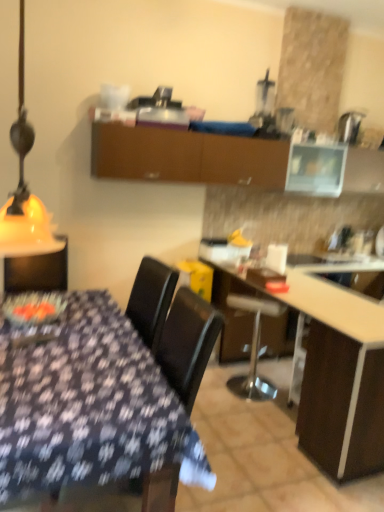
Where is `white glossy countertop at center`? This screenshot has width=384, height=512. white glossy countertop at center is located at coordinates (327, 298).

This screenshot has width=384, height=512. Find the location of `wooden table at center`. wooden table at center is located at coordinates (333, 370).

What are the coordinates of `brown matte cabinet at upper center` in the screenshot? It's located at (186, 156).

Describe the element at coordinates (254, 348) in the screenshot. I see `metallic silver bar stool at center` at that location.

Image resolution: width=384 pixels, height=512 pixels. What are the coordinates of `yellow matte lampshade at left` in the screenshot? It's located at (24, 189).

From the image's perspective, which is above, brown matte cabinet at upper center or metallic silver bar stool at center?

From the image's view, brown matte cabinet at upper center is above.

Which of these two, brown matte cabinet at upper center or metallic silver bar stool at center, is thinner?

metallic silver bar stool at center.

In order to click on cabinetry on the right side of metallic silver bar stool at center in this screenshot , I will do `click(186, 156)`.

In the image, is brown matte cabinet at upper center positioned in front of or behind metallic silver bar stool at center?

Visually, brown matte cabinet at upper center is located behind metallic silver bar stool at center.

From the image's perspective, which one is positioned lower, metallic silver bar stool at center or black matte chair at center?

black matte chair at center appears lower in the image.

Can you confirm if metallic silver bar stool at center is positioned to the left of black matte chair at center?

In fact, metallic silver bar stool at center is to the right of black matte chair at center.

Is black matte chair at center at the back of metallic silver bar stool at center?

Yes, metallic silver bar stool at center is facing away from black matte chair at center.

Between yellow matte lampshade at left and metallic silver bar stool at center, which one appears on the left side from the viewer's perspective?

From the viewer's perspective, yellow matte lampshade at left appears more on the left side.

Is yellow matte lampshade at left facing towards metallic silver bar stool at center?

No, yellow matte lampshade at left is not aimed at metallic silver bar stool at center.

From the image's perspective, which one is positioned higher, yellow matte lampshade at left or metallic silver bar stool at center?

yellow matte lampshade at left.

The width and height of the screenshot is (384, 512). I want to click on bar stool that is on the right side of yellow matte lampshade at left, so click(254, 348).

Is metallic silver bar stool at center positioned with its back to yellow matte lampshade at left?

metallic silver bar stool at center is not turned away from yellow matte lampshade at left.

Is metallic silver bar stool at center in front of yellow matte lampshade at left?

No, it is not.

From the image's perspective, between black matte chair at center and brown matte cabinet at upper center, which one is located above?

brown matte cabinet at upper center, from the image's perspective.

In the image, there is a brown matte cabinet at upper center. What are the coordinates of `chair below it (from a real-world perspective)` in the screenshot? It's located at (187, 344).

Is black matte chair at center oriented towards brown matte cabinet at upper center?

No, black matte chair at center is not facing towards brown matte cabinet at upper center.

Is there a large distance between black matte chair at center and brown matte cabinet at upper center?

Absolutely, black matte chair at center is distant from brown matte cabinet at upper center.

From the image's perspective, is white glossy countertop at center located above or below yellow matte lampshade at left?

Clearly, from the image's perspective, white glossy countertop at center is below yellow matte lampshade at left.

Can you tell me how much white glossy countertop at center and yellow matte lampshade at left differ in facing direction?

They differ by 87 degrees in their facing directions.

Does white glossy countertop at center have a greater height compared to yellow matte lampshade at left?

Incorrect, the height of white glossy countertop at center is not larger of that of yellow matte lampshade at left.

Visually, is white glossy countertop at center positioned to the left or to the right of yellow matte lampshade at left?

In the image, white glossy countertop at center appears on the right side of yellow matte lampshade at left.

From the image's perspective, which is below, white glossy countertop at center or black matte chair at center?

black matte chair at center appears lower in the image.

Is white glossy countertop at center behind black matte chair at center?

Yes, it is.

Where is `chair that appears in front of the white glossy countertop at center`? The image size is (384, 512). chair that appears in front of the white glossy countertop at center is located at coordinates pyautogui.click(x=187, y=344).

Identify the location of bar stool in front of the brown matte cabinet at upper center. Image resolution: width=384 pixels, height=512 pixels. (254, 348).

Identify the location of bar stool that appears behind the black matte chair at center. The height and width of the screenshot is (512, 384). (254, 348).

Looking at the image, which one is located closer to metallic silver bar stool at center, white glossy countertop at center or brown matte cabinet at upper center?

white glossy countertop at center is positioned closer to the anchor metallic silver bar stool at center.

From the picture: From the image, which object appears to be farther from black matte chair at center, white glossy countertop at center or yellow matte lampshade at left?

The object further to black matte chair at center is white glossy countertop at center.

When comparing their distances from brown matte cabinet at upper center, does metallic silver bar stool at center or white glossy countertop at center seem closer?

white glossy countertop at center is positioned closer to the anchor brown matte cabinet at upper center.

Based on their spatial positions, is brown matte cabinet at upper center or yellow matte lampshade at left closer to wooden table at center?

brown matte cabinet at upper center is closer to wooden table at center.

Looking at the image, which one is located closer to white glossy countertop at center, black matte chair at center or wooden table at center?

wooden table at center is positioned closer to the anchor white glossy countertop at center.

From the image, which object appears to be farther from metallic silver bar stool at center, yellow matte lampshade at left or wooden table at center?

yellow matte lampshade at left lies further to metallic silver bar stool at center than the other object.

From the image, which object appears to be farther from brown matte cabinet at upper center, white glossy countertop at center or metallic silver bar stool at center?

metallic silver bar stool at center.

Estimate the real-world distances between objects in this image. Which object is further from yellow matte lampshade at left, wooden table at center or metallic silver bar stool at center?

metallic silver bar stool at center lies further to yellow matte lampshade at left than the other object.

Where is `cabinetry between black matte chair at center and white glossy countertop at center in the front-back direction`? The height and width of the screenshot is (512, 384). cabinetry between black matte chair at center and white glossy countertop at center in the front-back direction is located at coordinates (186, 156).

This screenshot has height=512, width=384. What are the coordinates of `bar stool between black matte chair at center and brown matte cabinet at upper center from front to back` in the screenshot? It's located at (254, 348).

Where is `table positioned between yellow matte lampshade at left and white glossy countertop at center from near to far`? table positioned between yellow matte lampshade at left and white glossy countertop at center from near to far is located at coordinates (333, 370).

Identify the location of countertop between brown matte cabinet at upper center and wooden table at center vertically. The height and width of the screenshot is (512, 384). (327, 298).